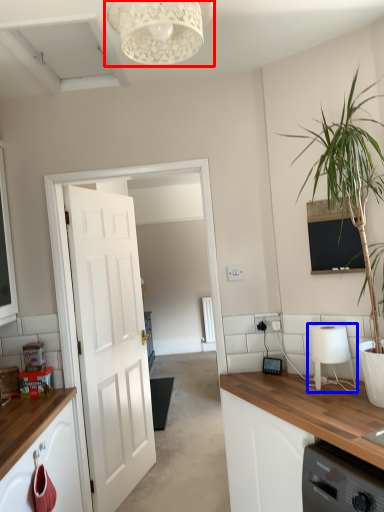
Question: Among these objects, which one is farthest to the camera, light fixture (highlighted by a red box) or appliance (highlighted by a blue box)?

Choices:
 (A) light fixture
 (B) appliance

Answer: (B)